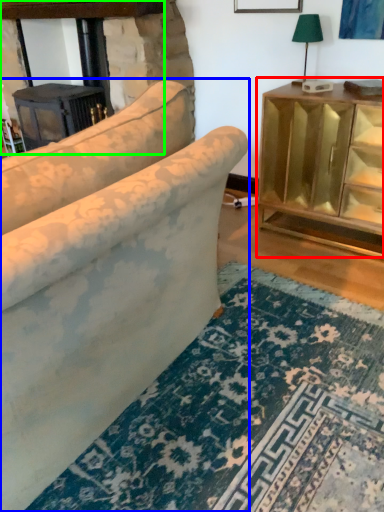
Question: Based on their relative distances, which object is farther from table (highlighted by a red box)? Choose from studio couch (highlighted by a blue box) and fireplace (highlighted by a green box).

Choices:
 (A) studio couch
 (B) fireplace

Answer: (B)